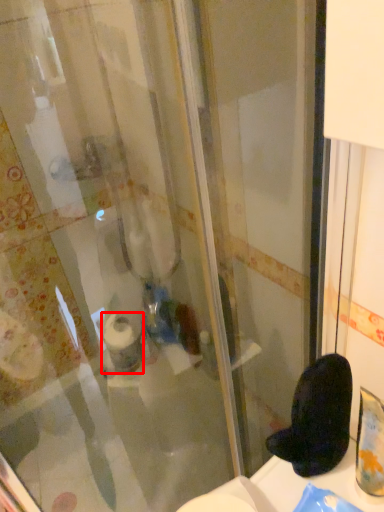
Question: Where is toilet paper (annotated by the red box) located in relation to footwear in the image?

Choices:
 (A) left
 (B) right

Answer: (A)